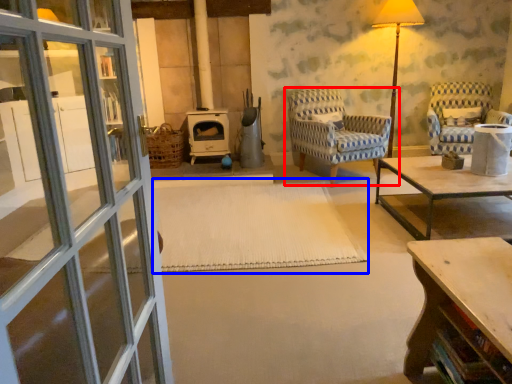
Question: Which object appears farthest to the camera in this image, chair (highlighted by a red box) or mat (highlighted by a blue box)?

Choices:
 (A) chair
 (B) mat

Answer: (A)